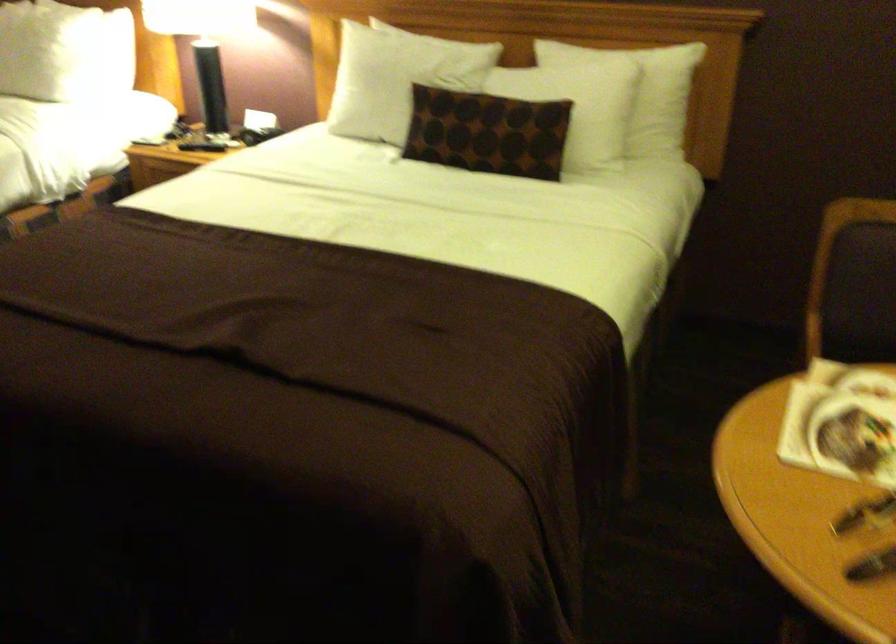
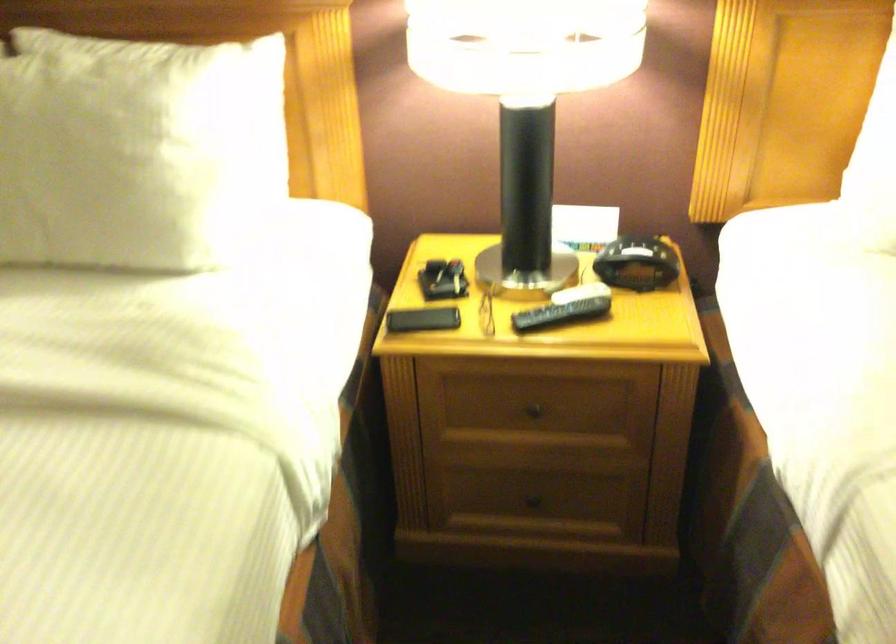
Question: I am providing you with two images of the same scene from different viewpoints. Please identify which objects are invisible in image2.

Choices:
 (A) white pillow
 (B) drawer knob
 (C) black remote control
 (D) none of these

Answer: (D)